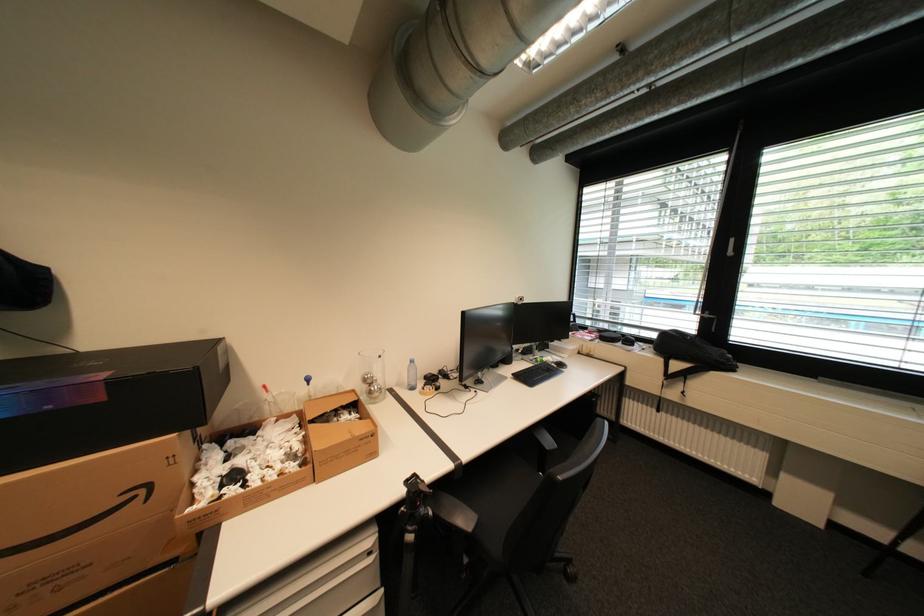
You are a GUI agent. You are given a task and a screenshot of the screen. Output one action in this format:
    pyautogui.click(x=<x>, y=<y>)
    Task: Click on the black chair sitting surface
    This screenshot has width=924, height=616.
    Given the screenshot: What is the action you would take?
    pyautogui.click(x=500, y=500)